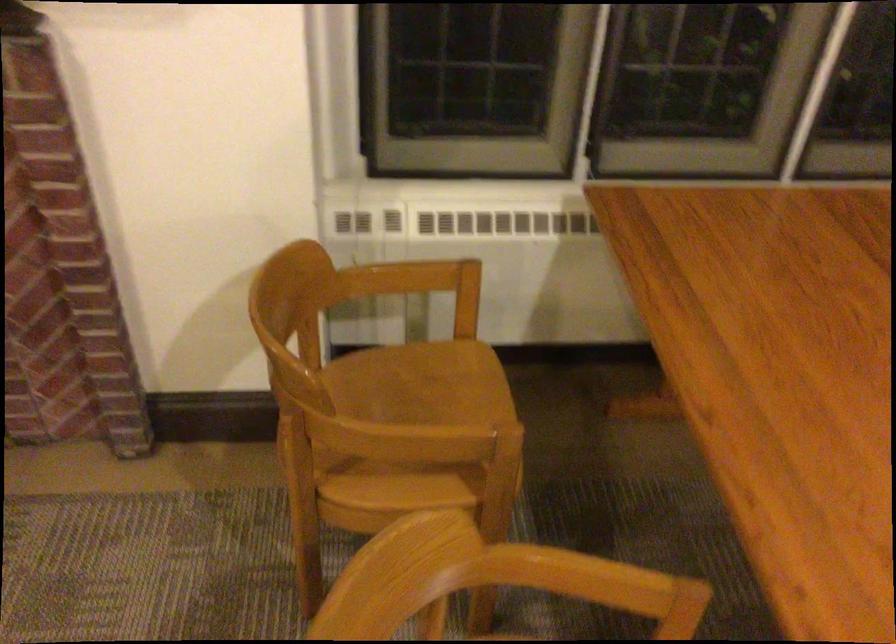
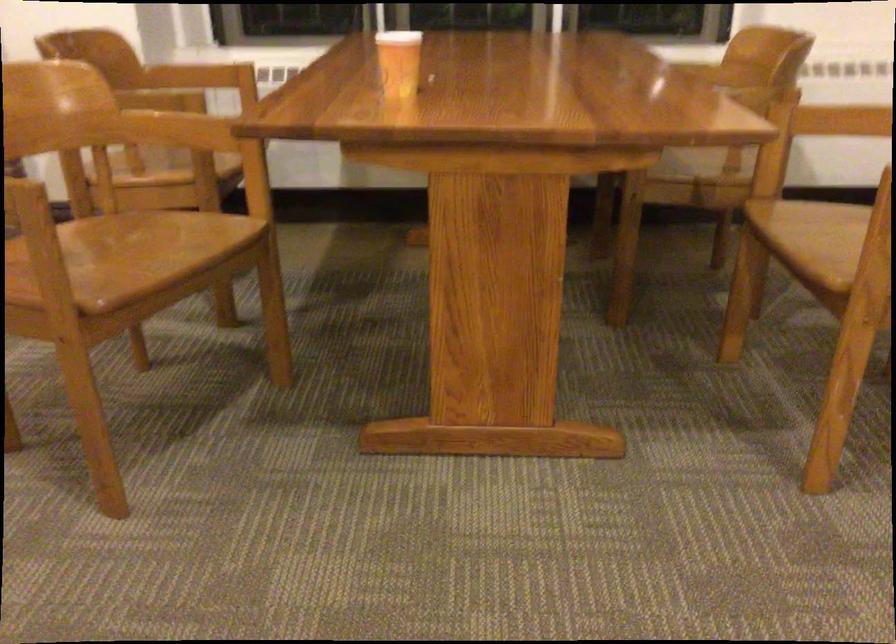
Based on the photo, in a continuous first-person perspective shot, in which direction is the camera moving?

The movement direction of the cameraman is right, backward.